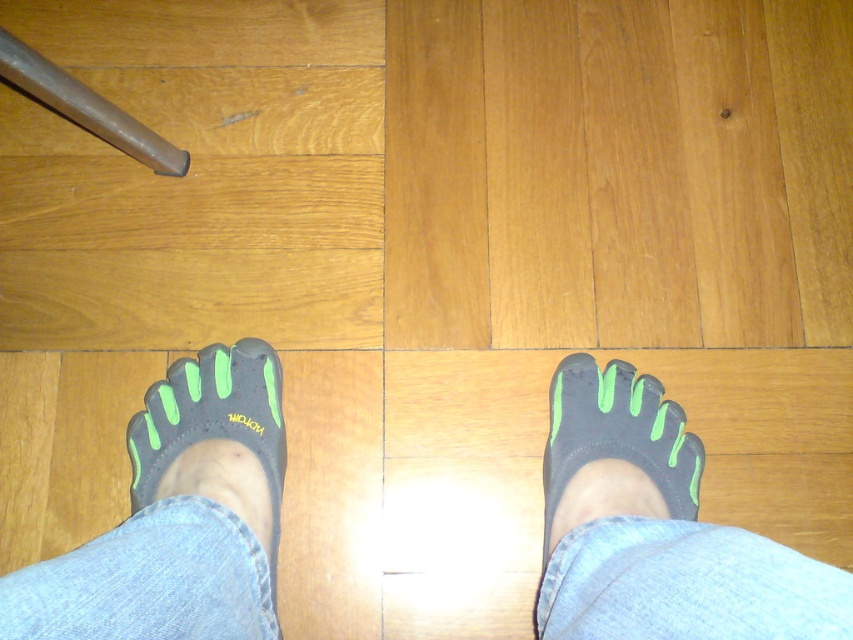
You are designing a shoe display stand and need to place both the matte black toe separator at lower center and the matte black toe shoe at lower left. Given their height difference, which one should you place on the lower shelf to ensure stability?

The matte black toe separator at lower center has a lesser height compared to the matte black toe shoe at lower left, so it should be placed on the lower shelf to ensure stability.